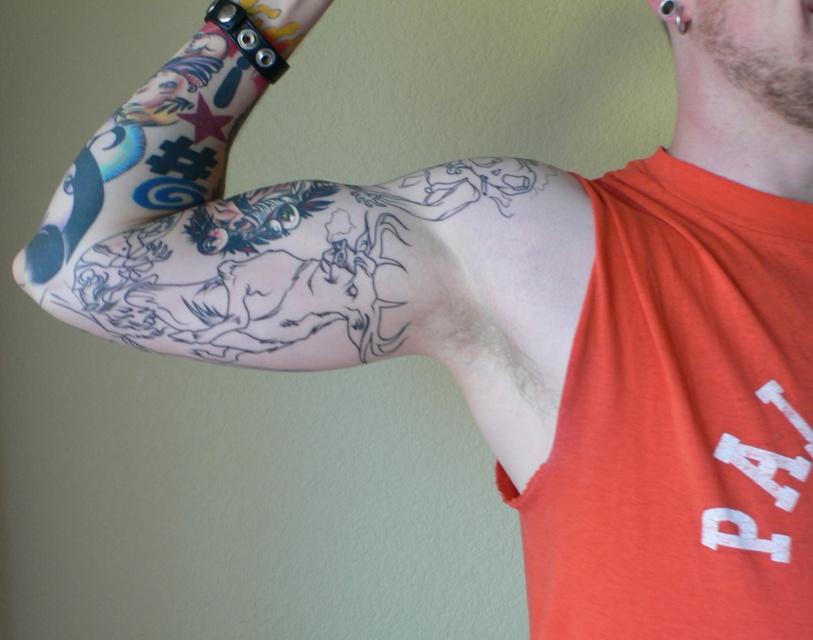
Does orange cotton tank top at upper right have a greater height compared to black ink tattoo at upper left?

Indeed, orange cotton tank top at upper right has a greater height compared to black ink tattoo at upper left.

Can you confirm if orange cotton tank top at upper right is thinner than black ink tattoo at upper left?

Indeed, orange cotton tank top at upper right has a lesser width compared to black ink tattoo at upper left.

Which is behind, point (672, 269) or point (348, 204)?

The point (672, 269) is more distant.

Where is `orange cotton tank top at upper right`? orange cotton tank top at upper right is located at coordinates (680, 420).